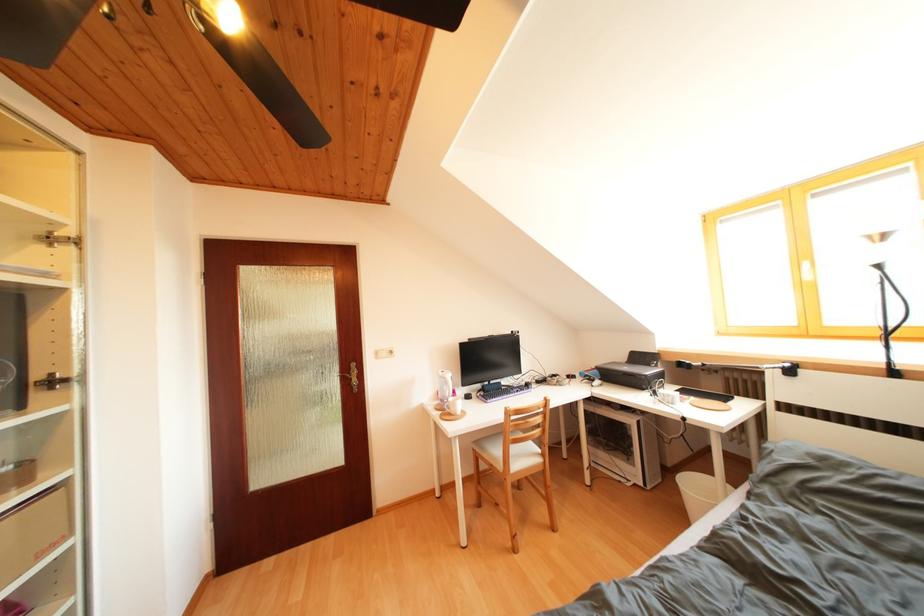
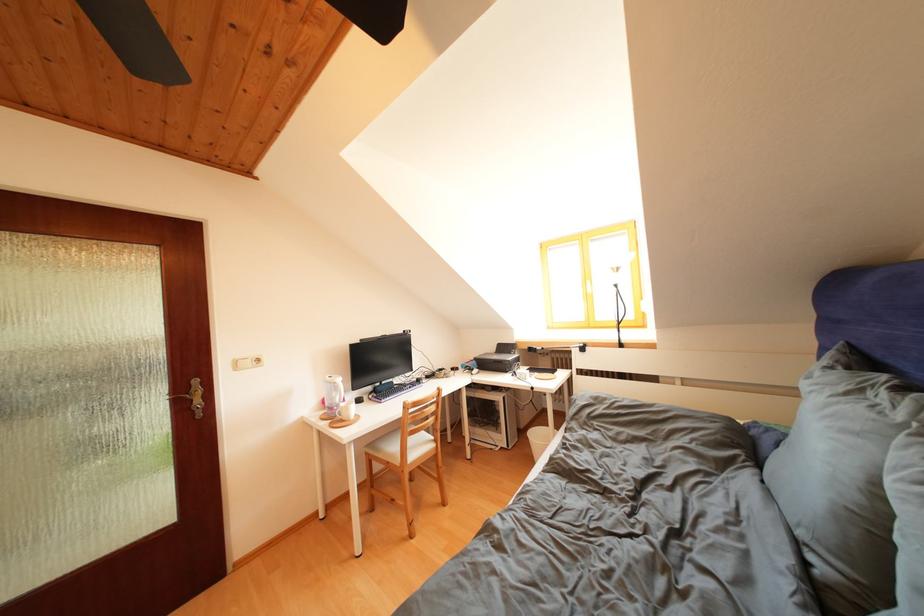
Find the pixel in the second image that matches (523,454) in the first image.

(419, 446)